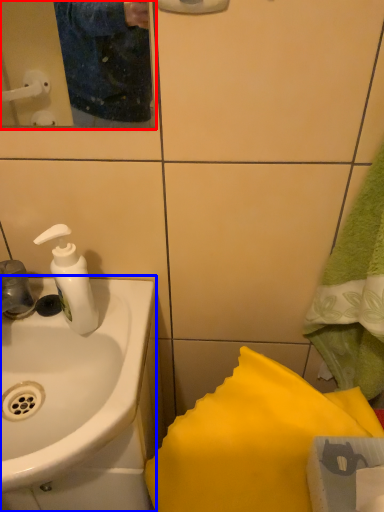
Question: Which object is closer to the camera taking this photo, mirror (highlighted by a red box) or sink (highlighted by a blue box)?

Choices:
 (A) mirror
 (B) sink

Answer: (A)